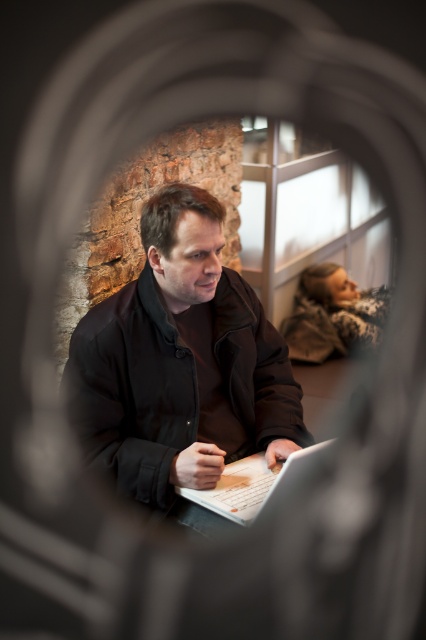
Measure the distance from matte black laptop at center to white matte laptop at center.

matte black laptop at center and white matte laptop at center are 25.32 centimeters apart from each other.

Does matte black laptop at center appear under white matte laptop at center?

Actually, matte black laptop at center is above white matte laptop at center.

Is point (141, 364) positioned behind point (255, 486)?

Yes.

At what (x,y) coordinates should I click in order to perform the action: click on matte black laptop at center. Please return your answer as a coordinate pair (x, y). The image size is (426, 640). Looking at the image, I should click on point(181,365).